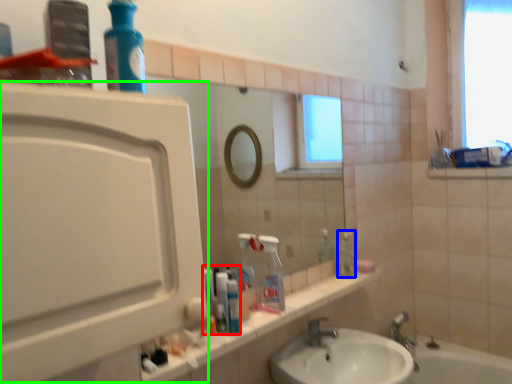
Question: Which object is the farthest from toiletry (highlighted by a red box)? Choose among these: bottle (highlighted by a blue box) or screen door (highlighted by a green box).

Choices:
 (A) bottle
 (B) screen door

Answer: (B)